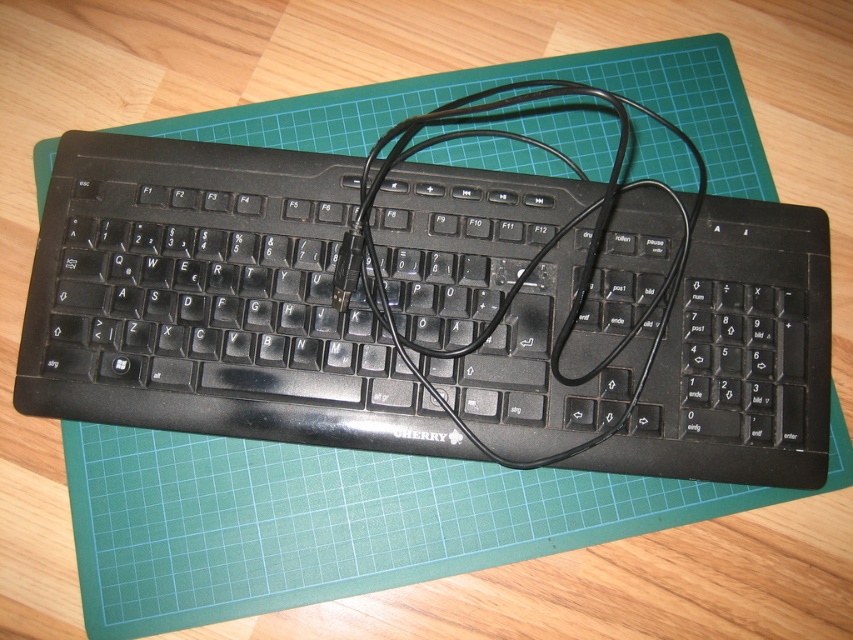
You are setting up a new workspace and want to ensure there is enough space for both the black plastic keyboard at center and the black cable at center. Given that the keyboard is smaller than the cable, which object requires more space on the wooden surface?

The black cable at center requires more space on the wooden surface because it is larger than the black plastic keyboard at center.

You are a delivery person who just arrived at a customer service center. You need to place a package on the wooden surface where the black plastic keyboard at center and the black cable at center are located. The package is 1 meter long. Can you place it between the two objects?

The black plastic keyboard at center is further to the viewer than black cable at center, so the distance between them is not specified. Therefore, it is uncertain if the package can fit between them.

Consider the image. You are a delivery person who just received a package containing a black plastic keyboard at center and a black cable at center. You need to place them on a desk. According to the image, which object is located underneath the other?

The black plastic keyboard at center is positioned under the black cable at center, so the keyboard is underneath the cable.